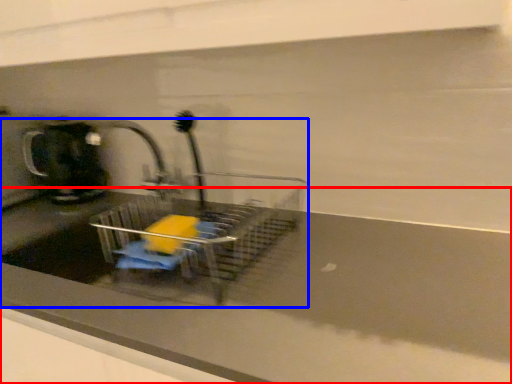
Question: Among these objects, which one is nearest to the camera, counter top (highlighted by a red box) or sink (highlighted by a blue box)?

Choices:
 (A) counter top
 (B) sink

Answer: (A)